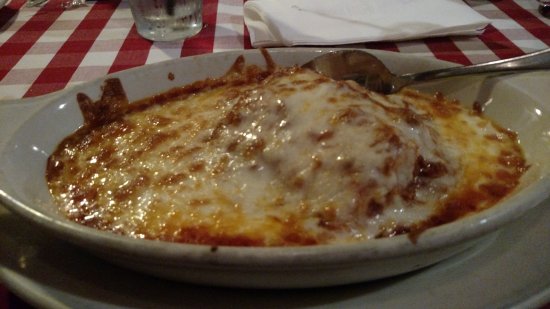
Find the location of a particular element. inside of a white bowl is located at coordinates (512, 112).